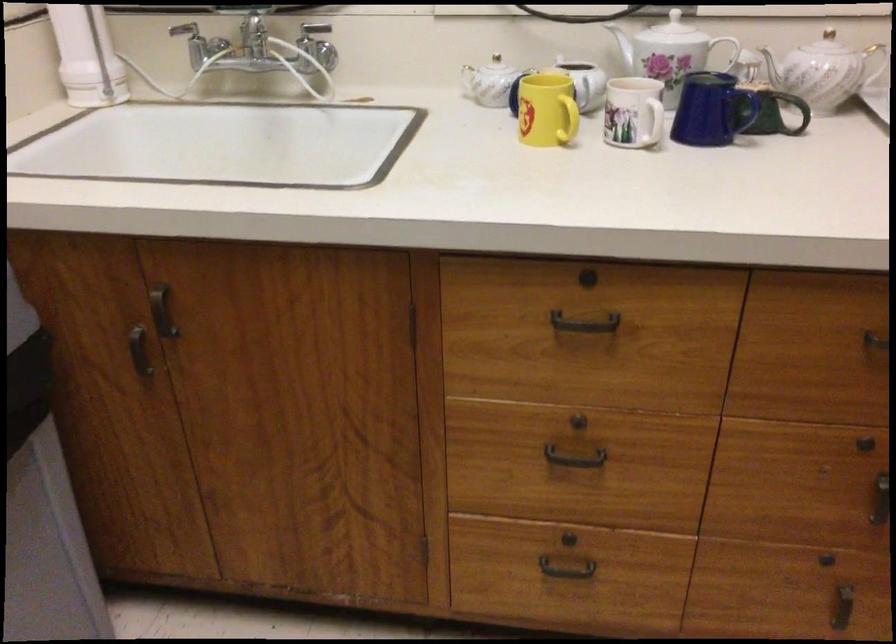
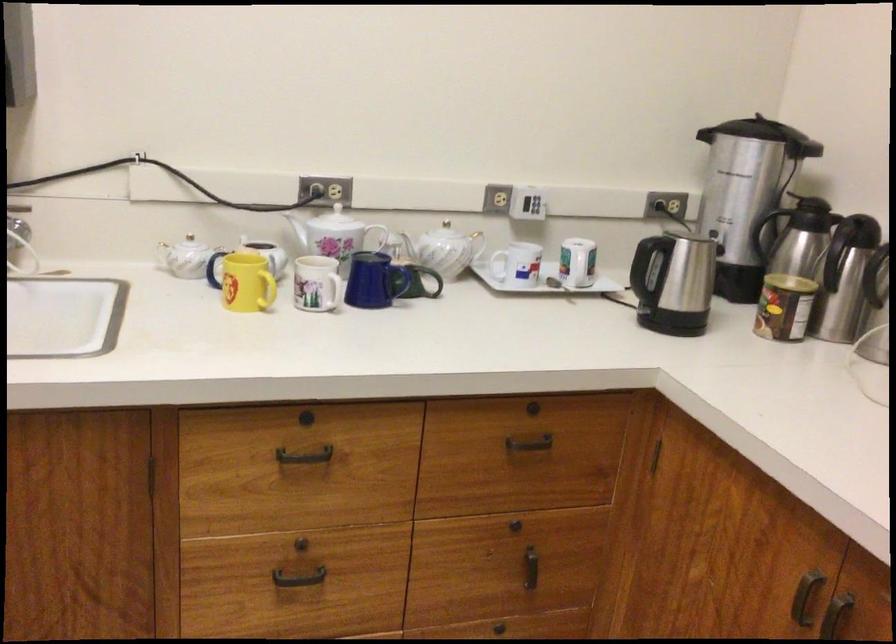
Where in the second image is the point corresponding to point (564, 115) from the first image?

(268, 289)